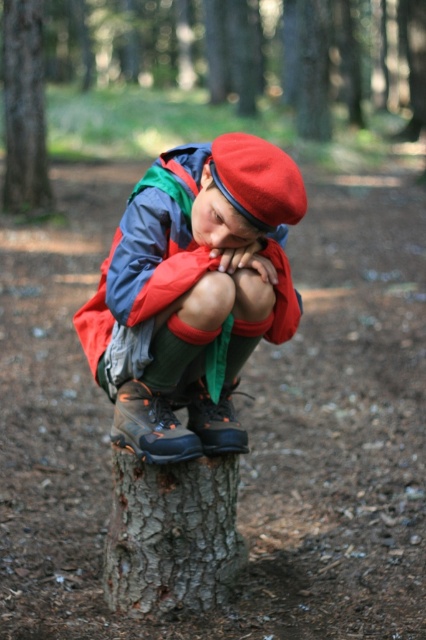
Can you confirm if matte red beret at center is shorter than red felt beret at center?

No.

Image resolution: width=426 pixels, height=640 pixels. I want to click on matte red beret at center, so click(193, 291).

Can you confirm if gray rough bark tree trunk at center is bigger than red felt beret at center?

Indeed, gray rough bark tree trunk at center has a larger size compared to red felt beret at center.

Measure the distance between gray rough bark tree trunk at center and red felt beret at center.

gray rough bark tree trunk at center and red felt beret at center are 1.01 meters apart.

Locate an element on the screen. gray rough bark tree trunk at center is located at coordinates (172, 536).

Is brown rough tree stump at center bigger than matte red beret at center?

Yes.

At what (x,y) coordinates should I click in order to perform the action: click on brown rough tree stump at center. Please return your answer as a coordinate pair (x, y). Image resolution: width=426 pixels, height=640 pixels. Looking at the image, I should click on (201, 76).